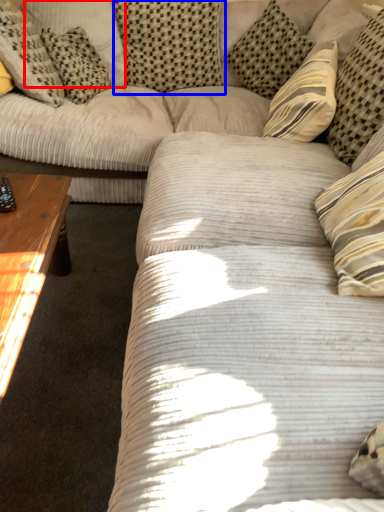
Question: Which of the following is the farthest to the observer, pillow (highlighted by a red box) or pillow (highlighted by a blue box)?

Choices:
 (A) pillow
 (B) pillow

Answer: (A)